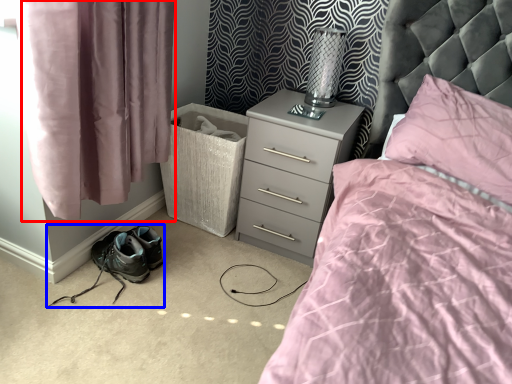
Question: Among these objects, which one is nearest to the camera, curtain (highlighted by a red box) or footwear (highlighted by a blue box)?

Choices:
 (A) curtain
 (B) footwear

Answer: (A)